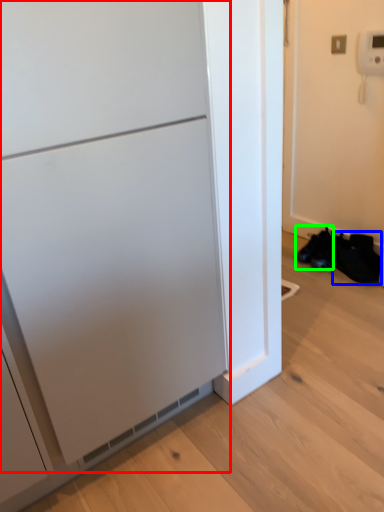
Question: Considering the real-world distances, which object is closest to appliance (highlighted by a red box)? shoe (highlighted by a blue box) or footwear (highlighted by a green box).

Choices:
 (A) shoe
 (B) footwear

Answer: (A)